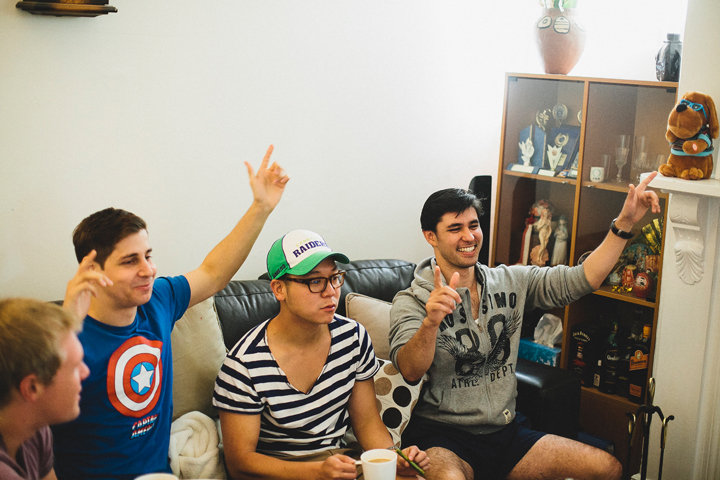
Identify the location of coffee mug. click(382, 470).